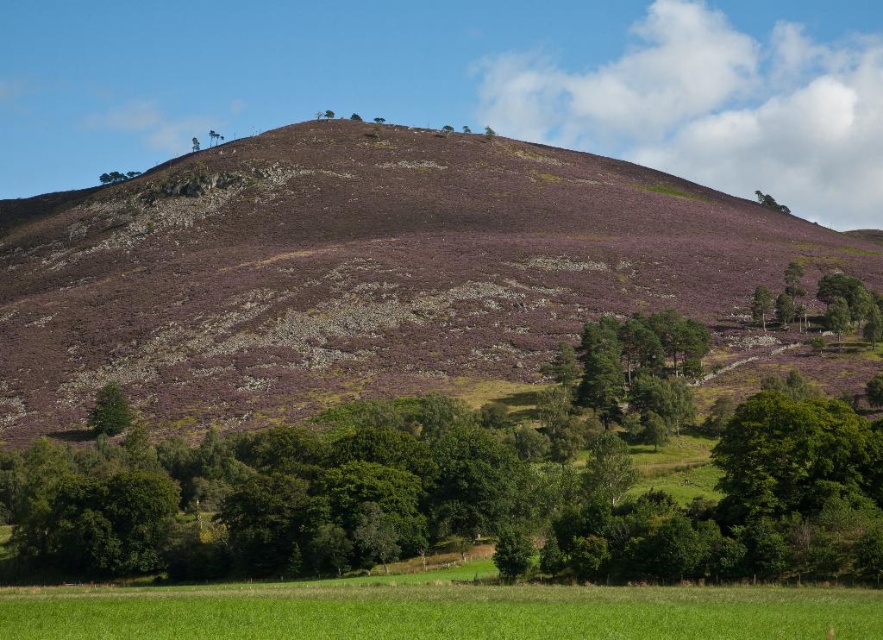
You are standing in the green field looking towards the hill. Which object, the purple heather at upper center or the green leafy tree at upper center, is closer to you?

The purple heather at upper center is closer to you because it is positioned below the green leafy tree at upper center, indicating it is lower on the visual plane and thus nearer in the landscape.

You are standing at the bottom of the hill in the green field and want to reach the point marked at coordinates point (358, 269). Which direction should you head to reach it?

The point (358, 269) is on the purple heather at upper center, so you should head upwards towards the hill to reach it.

In the scene shown: You are standing in the foreground of the scene and want to walk towards the green leafy tree at upper center. However, there is another green leafy tree at upper right in your path. Based on the scene description, which tree will you encounter first?

The green leafy tree at upper center is positioned over the green leafy tree at upper right, so you will encounter the green leafy tree at upper center first as it is closer to you.